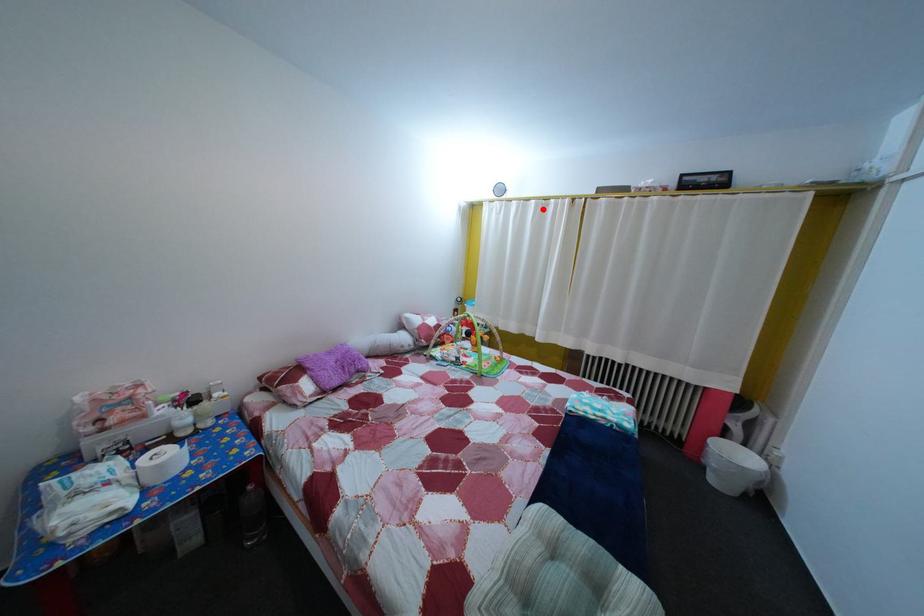
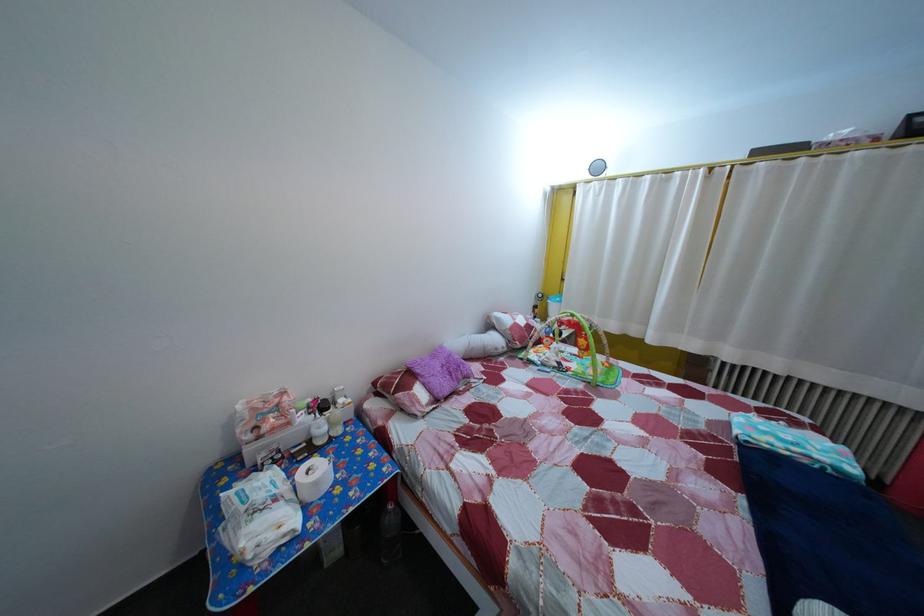
Find the pixel in the second image that matches the highlighted location in the first image.

(659, 185)